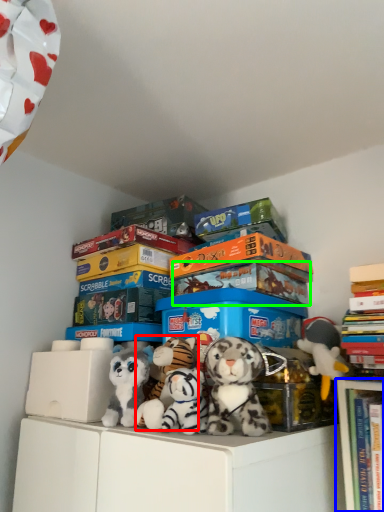
Question: Estimate the real-world distances between objects in this image. Which object is closer to toy (highlighted by a red box), bookcase (highlighted by a blue box) or storage box (highlighted by a green box)?

Choices:
 (A) bookcase
 (B) storage box

Answer: (B)